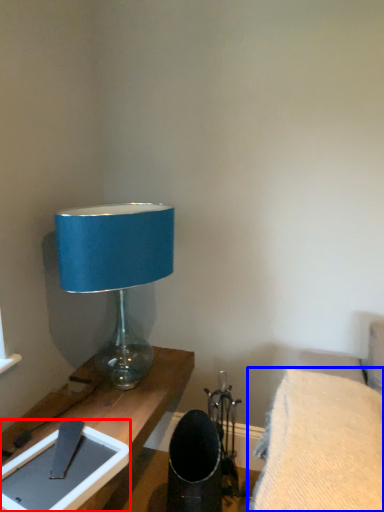
Question: Which object is further to the camera taking this photo, tablet computer (highlighted by a red box) or furniture (highlighted by a blue box)?

Choices:
 (A) tablet computer
 (B) furniture

Answer: (A)